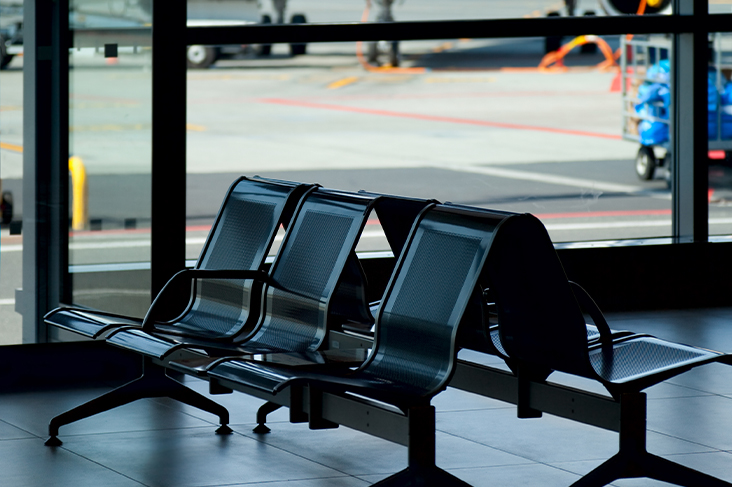
Find the location of a particular element. Image resolution: width=732 pixels, height=487 pixels. seat of chair is located at coordinates (81, 318), (179, 340), (268, 379).